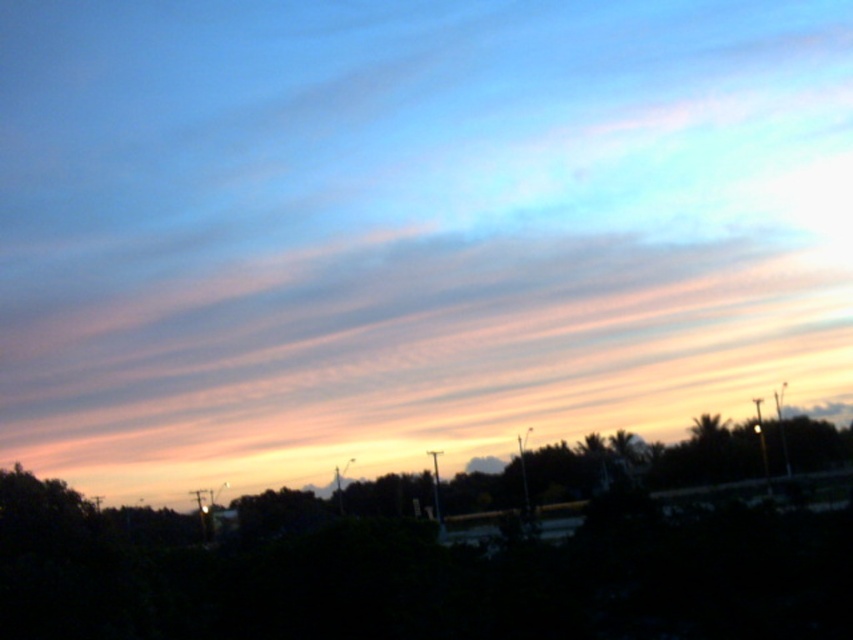
You are a photographer trying to capture the sunset. You notice a point at coordinates point (410, 353) in the image. Based on the scene description, where is this point located?

The point (410, 353) is on pink translucent clouds at upper center.

You are an artist trying to paint the sunset scene. You need to decide the size of the pink translucent clouds at upper center and dark green leafy tree at lower center. Which one should you paint larger?

The pink translucent clouds at upper center should be painted larger since they are larger than the dark green leafy tree at lower center according to the description.